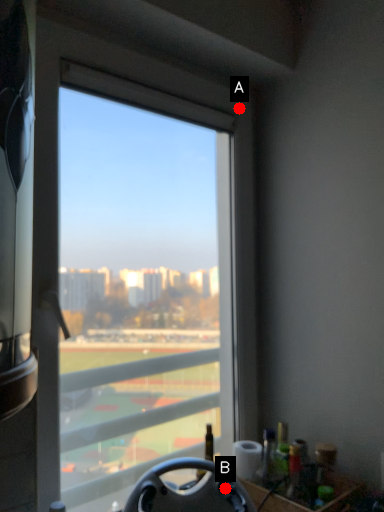
Question: Two points are circled on the image, labeled by A and B beside each circle. Among these points, which one is nearest to the camera?

Choices:
 (A) A is closer
 (B) B is closer

Answer: (B)